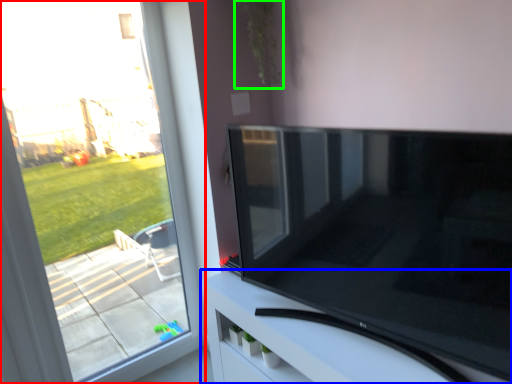
Question: Which object is positioned farthest from window (highlighted by a red box)? Select from furniture (highlighted by a blue box) and plant (highlighted by a green box).

Choices:
 (A) furniture
 (B) plant

Answer: (B)